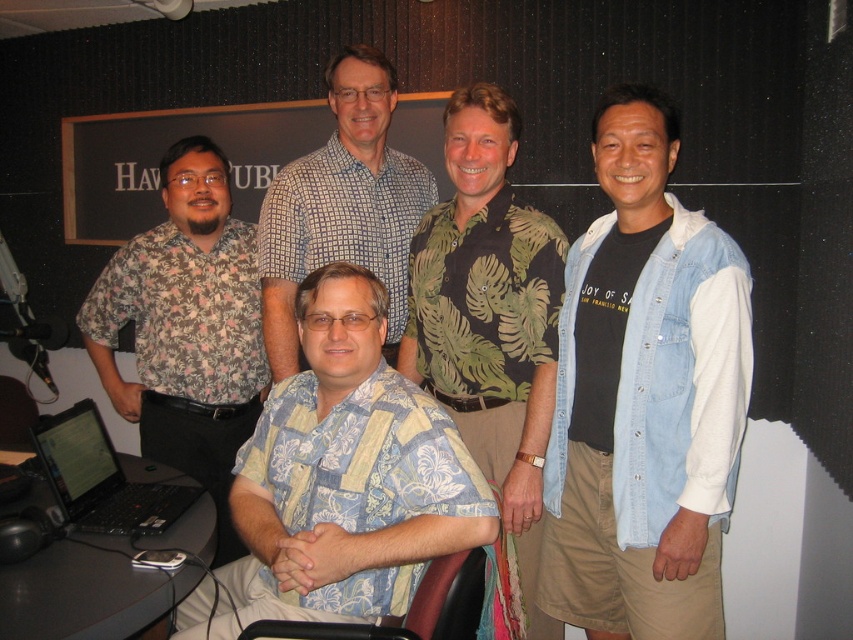
You are a photographer setting up a photo shoot in the studio. You need to adjust the height of the camera to capture both the denim vest at right and the floral print shirt at left clearly. Which clothing item requires the camera to be positioned lower to ensure it is in focus?

The denim vest at right has a lesser height compared to the floral print shirt at left, so the camera should be positioned lower to focus on the denim vest at right while still capturing the taller floral print shirt at left.

Based on the photo, you are a photographer setting up a shoot in this studio. You need to adjust the lighting so that both the green leafy shirt at center and the floral print shirt at left are evenly illuminated. Considering their heights, which shirt should you focus the light on more to ensure proper exposure?

The green leafy shirt at center is taller than the floral print shirt at left. To ensure proper exposure, focus more light on the taller green leafy shirt at center since it requires coverage over a larger area.

You are organizing a photo shoot and need to ensure that the denim vest at right and the floral print shirt at left are visible in the frame. Given their sizes, which one might require more careful framing to avoid being cropped out?

The denim vest at right occupies less space than the floral print shirt at left, so the floral print shirt at left might require more careful framing to avoid being cropped out since it takes up more area in the image.